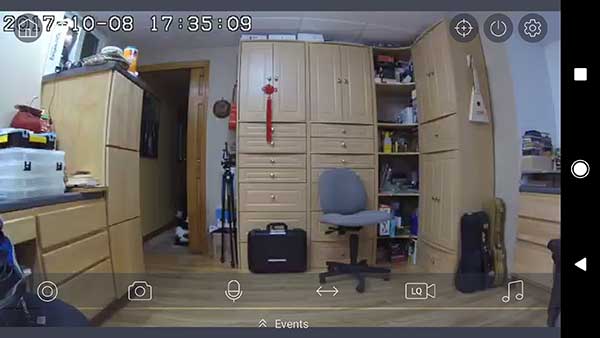
The height and width of the screenshot is (338, 600). Find the location of `open door way`. open door way is located at coordinates (168, 154).